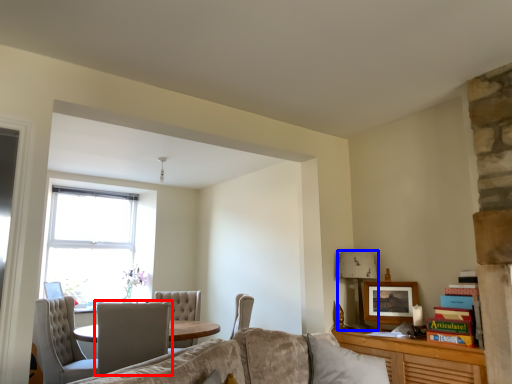
Question: Which object is further to the camera taking this photo, chair (highlighted by a red box) or lamp (highlighted by a blue box)?

Choices:
 (A) chair
 (B) lamp

Answer: (B)